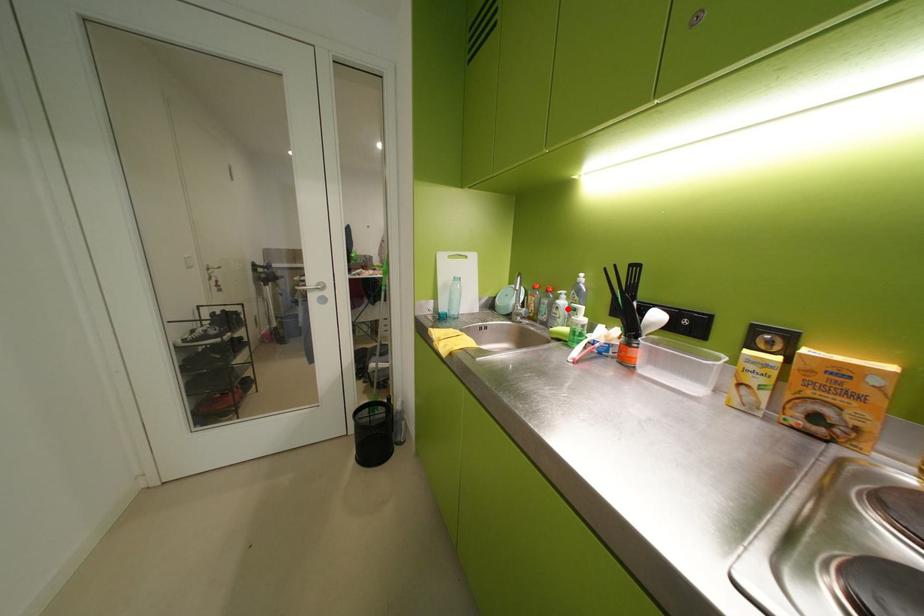
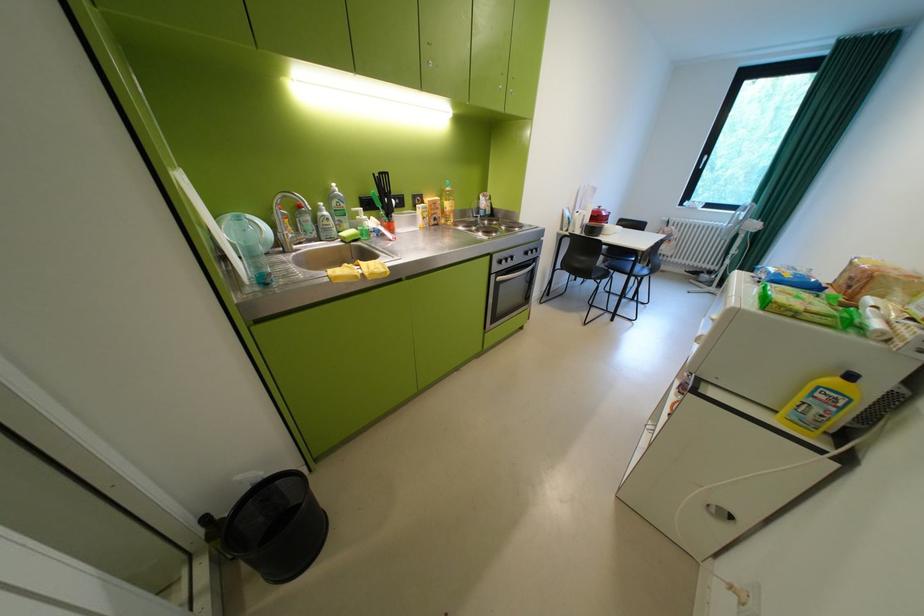
The point at the highlighted location is marked in the first image. Where is the corresponding point in the second image?

(338, 220)